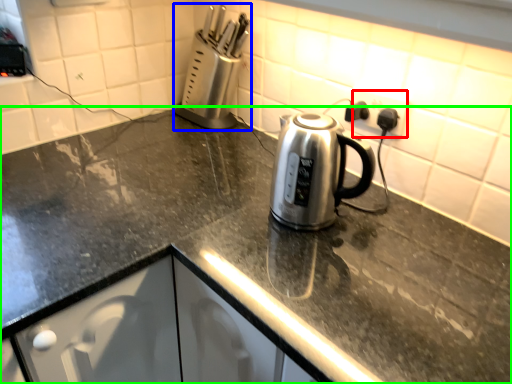
Question: Which object is the farthest from electric outlet (highlighted by a red box)? Choose among these: appliance (highlighted by a blue box) or countertop (highlighted by a green box).

Choices:
 (A) appliance
 (B) countertop

Answer: (B)